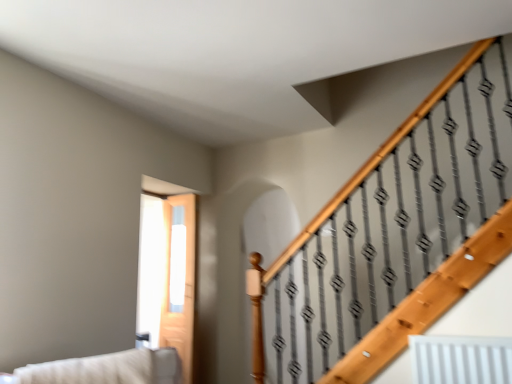
Question: Considering the positions of clear glass door at center and beige fabric couch at lower left in the image, is clear glass door at center taller or shorter than beige fabric couch at lower left?

Choices:
 (A) tall
 (B) short

Answer: (A)

Question: Does point (188, 241) appear closer or farther from the camera than point (150, 355)?

Choices:
 (A) farther
 (B) closer

Answer: (A)

Question: In terms of size, does clear glass door at center appear bigger or smaller than beige fabric couch at lower left?

Choices:
 (A) big
 (B) small

Answer: (B)

Question: Relative to clear glass door at center, is beige fabric couch at lower left in front or behind?

Choices:
 (A) front
 (B) behind

Answer: (A)

Question: From a real-world perspective, is beige fabric couch at lower left physically located above or below clear glass door at center?

Choices:
 (A) above
 (B) below

Answer: (B)

Question: Do you think beige fabric couch at lower left is within clear glass door at center, or outside of it?

Choices:
 (A) outside
 (B) inside

Answer: (A)

Question: From their relative heights in the image, would you say beige fabric couch at lower left is taller or shorter than clear glass door at center?

Choices:
 (A) tall
 (B) short

Answer: (B)